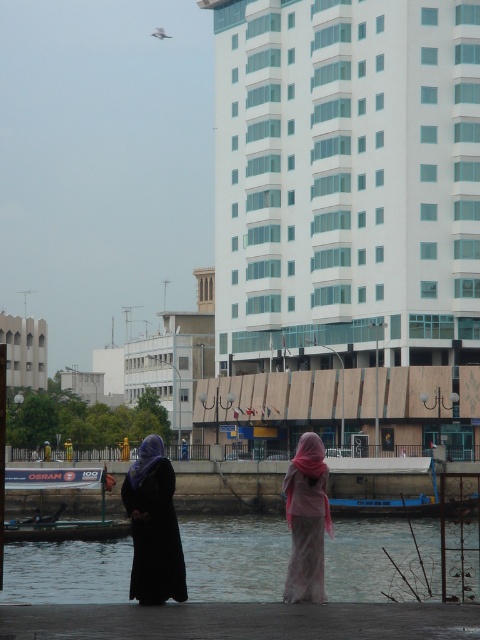
You are an architect evaluating the scale of elements in the waterfront scene. Given the white glass building at upper center and the matte black hijab at lower left, which object occupies more visual space in the image?

The white glass building at upper center is bigger than the matte black hijab at lower left, so it occupies more visual space in the image.